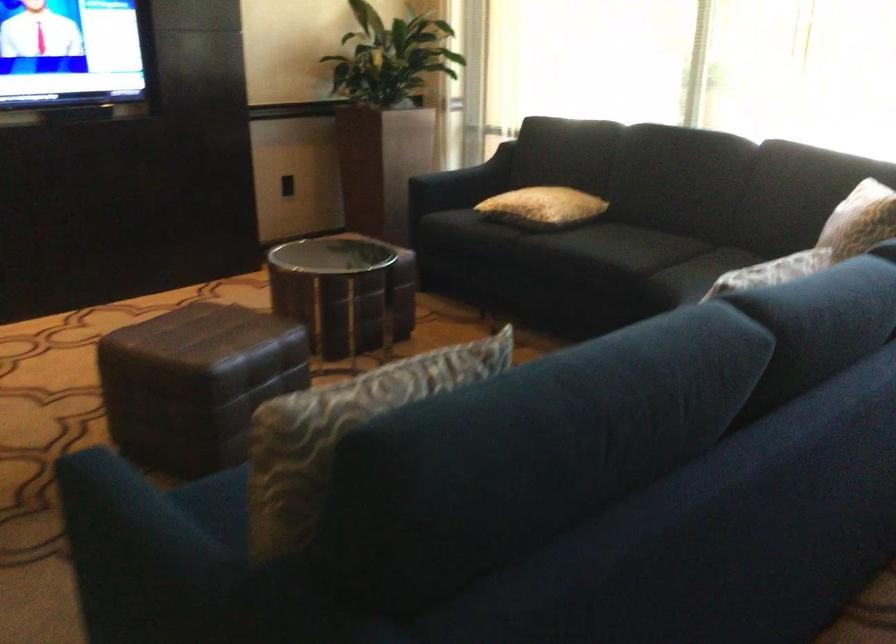
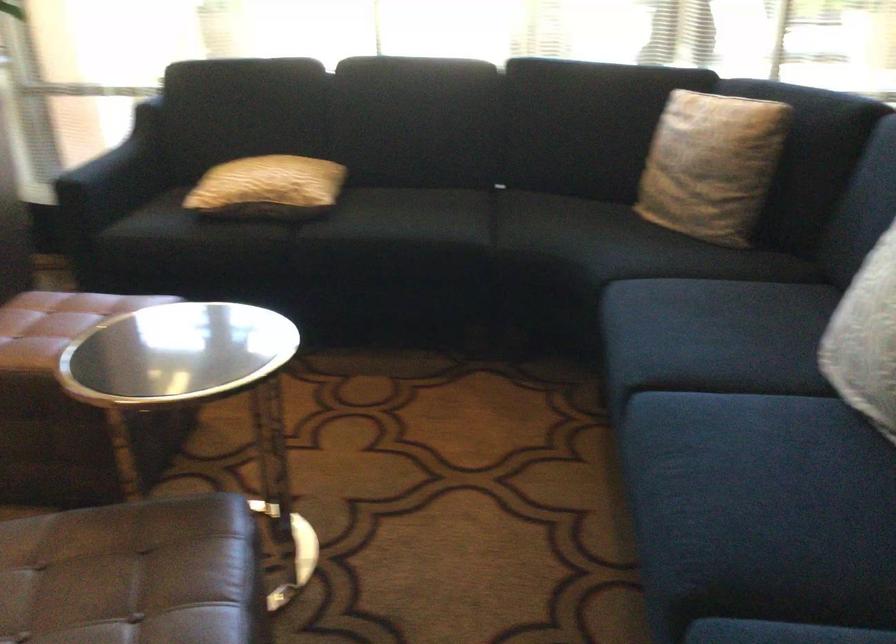
The point at [452,183] is marked in the first image. Where is the corresponding point in the second image?

(115, 176)